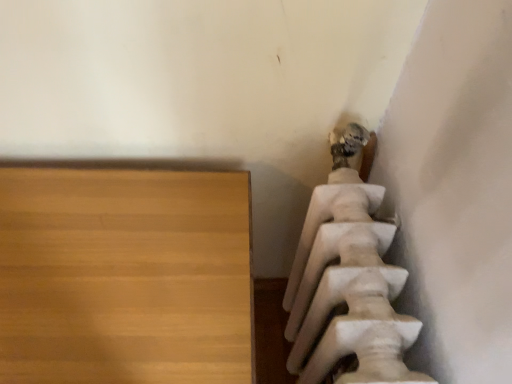
Measure the distance between point (170,193) and camera.

32.28 inches.

What are the coordinates of `light brown wood table at lower left` in the screenshot? It's located at (124, 277).

Measure the distance between light brown wood table at lower left and camera.

23.39 inches.

What do you see at coordinates (124, 277) in the screenshot? The width and height of the screenshot is (512, 384). I see `light brown wood table at lower left` at bounding box center [124, 277].

What is the approximate width of light brown wood table at lower left?

17.29 inches.

At what (x,y) coordinates should I click in order to perform the action: click on white marble statue at upper right. Please return your answer as a coordinate pair (x, y). The height and width of the screenshot is (384, 512). Looking at the image, I should click on (348, 281).

What do you see at coordinates (348, 281) in the screenshot? I see `white marble statue at upper right` at bounding box center [348, 281].

The image size is (512, 384). In order to click on light brown wood table at lower left in this screenshot , I will do `click(124, 277)`.

Considering the relative positions of light brown wood table at lower left and white marble statue at upper right in the image provided, is light brown wood table at lower left to the right of white marble statue at upper right from the viewer's perspective?

In fact, light brown wood table at lower left is to the left of white marble statue at upper right.

Looking at this image, does light brown wood table at lower left come in front of white marble statue at upper right?

No, the depth of light brown wood table at lower left is greater than that of white marble statue at upper right.

Is point (105, 176) closer to camera compared to point (383, 380)?

That is False.

From the image's perspective, is light brown wood table at lower left over white marble statue at upper right?

No, from the image's perspective, light brown wood table at lower left is not over white marble statue at upper right.

From a real-world perspective, who is located higher, light brown wood table at lower left or white marble statue at upper right?

white marble statue at upper right is physically above.

Considering the relative sizes of light brown wood table at lower left and white marble statue at upper right in the image provided, is light brown wood table at lower left wider than white marble statue at upper right?

Indeed, light brown wood table at lower left has a greater width compared to white marble statue at upper right.

Does light brown wood table at lower left have a lesser height compared to white marble statue at upper right?

No.

Considering the relative sizes of light brown wood table at lower left and white marble statue at upper right in the image provided, is light brown wood table at lower left smaller than white marble statue at upper right?

Actually, light brown wood table at lower left might be larger than white marble statue at upper right.

Is white marble statue at upper right a part of light brown wood table at lower left?

That's incorrect, white marble statue at upper right is not inside light brown wood table at lower left.

Would you consider light brown wood table at lower left to be distant from white marble statue at upper right?

Actually, light brown wood table at lower left and white marble statue at upper right are a little close together.

Is light brown wood table at lower left looking in the opposite direction of white marble statue at upper right?

No, white marble statue at upper right is not at the back of light brown wood table at lower left.

From the picture: How far apart are light brown wood table at lower left and white marble statue at upper right?

light brown wood table at lower left and white marble statue at upper right are 27.46 centimeters apart.

This screenshot has width=512, height=384. I want to click on furniture below the white marble statue at upper right (from the image's perspective), so click(x=124, y=277).

Which is more to the right, white marble statue at upper right or light brown wood table at lower left?

white marble statue at upper right is more to the right.

Is white marble statue at upper right in front of or behind light brown wood table at lower left in the image?

white marble statue at upper right is positioned closer to the viewer than light brown wood table at lower left.

Is point (345, 284) positioned before point (222, 219)?

Yes.

From the image's perspective, is white marble statue at upper right located above or below light brown wood table at lower left?

Based on their image positions, white marble statue at upper right is located above light brown wood table at lower left.

From a real-world perspective, who is located higher, white marble statue at upper right or light brown wood table at lower left?

white marble statue at upper right.

Considering the relative sizes of white marble statue at upper right and light brown wood table at lower left in the image provided, is white marble statue at upper right wider than light brown wood table at lower left?

Incorrect, the width of white marble statue at upper right does not surpass that of light brown wood table at lower left.

Is white marble statue at upper right taller than light brown wood table at lower left?

No.

Who is smaller, white marble statue at upper right or light brown wood table at lower left?

white marble statue at upper right.

Which is correct: white marble statue at upper right is inside light brown wood table at lower left, or outside of it?

white marble statue at upper right is not enclosed by light brown wood table at lower left.

Is white marble statue at upper right touching light brown wood table at lower left?

There is a gap between white marble statue at upper right and light brown wood table at lower left.

Is white marble statue at upper right facing towards light brown wood table at lower left?

Yes, white marble statue at upper right is turned towards light brown wood table at lower left.

The height and width of the screenshot is (384, 512). In order to click on furniture below the white marble statue at upper right (from the image's perspective) in this screenshot , I will do `click(124, 277)`.

Where is `furniture behind the white marble statue at upper right`? The height and width of the screenshot is (384, 512). furniture behind the white marble statue at upper right is located at coordinates (124, 277).

Find the location of `statue (sculpture) on the right of light brown wood table at lower left`. statue (sculpture) on the right of light brown wood table at lower left is located at coordinates pos(348,281).